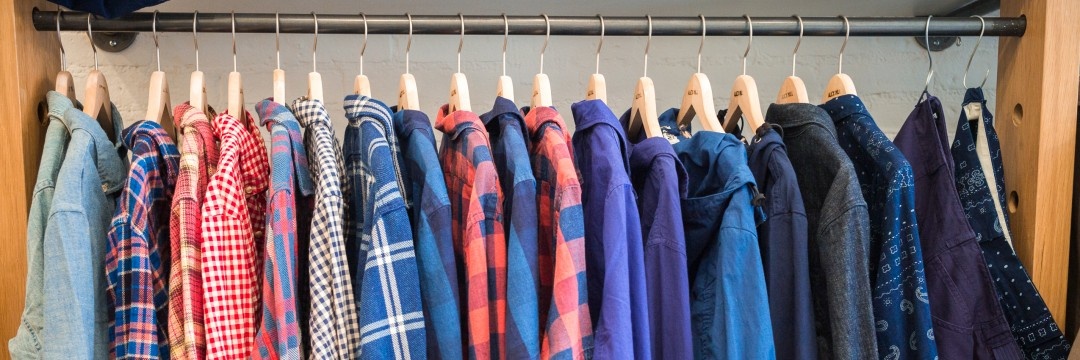
You are a GUI agent. You are given a task and a screenshot of the screen. Output one action in this format:
    pyautogui.click(x=<x>, y=<y>)
    Task: Click on the right side of closet
    The image size is (1080, 360).
    Given the screenshot: What is the action you would take?
    pyautogui.click(x=1056, y=133)